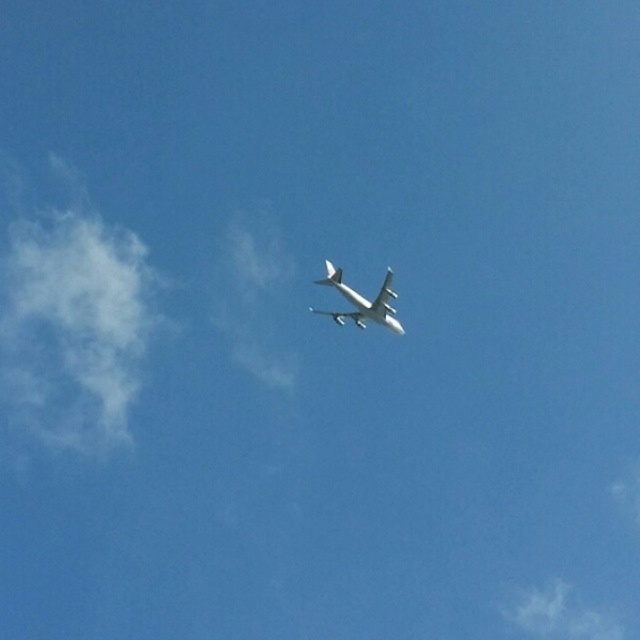
Describe the element at coordinates (72, 320) in the screenshot. I see `white fluffy cloud at left` at that location.

Is point (38, 244) closer to camera compared to point (515, 627)?

Yes, it is in front of point (515, 627).

This screenshot has width=640, height=640. I want to click on white fluffy cloud at left, so click(x=72, y=320).

Which is above, white fluffy cloud at left or white matte airplane at center?

white matte airplane at center is above.

The width and height of the screenshot is (640, 640). Describe the element at coordinates (72, 320) in the screenshot. I see `white fluffy cloud at left` at that location.

Does point (112, 300) come behind point (362, 310)?

Yes, it is.

Find the location of a particular element. white fluffy cloud at left is located at coordinates coord(72,320).

Measure the distance from white fluffy cloud at upper center to white matte airplane at center.

They are 130.08 meters apart.

Is point (500, 608) positioned before point (385, 304)?

No, (500, 608) is further to viewer.

Where is `white fluffy cloud at upper center`? This screenshot has width=640, height=640. white fluffy cloud at upper center is located at coordinates (560, 614).